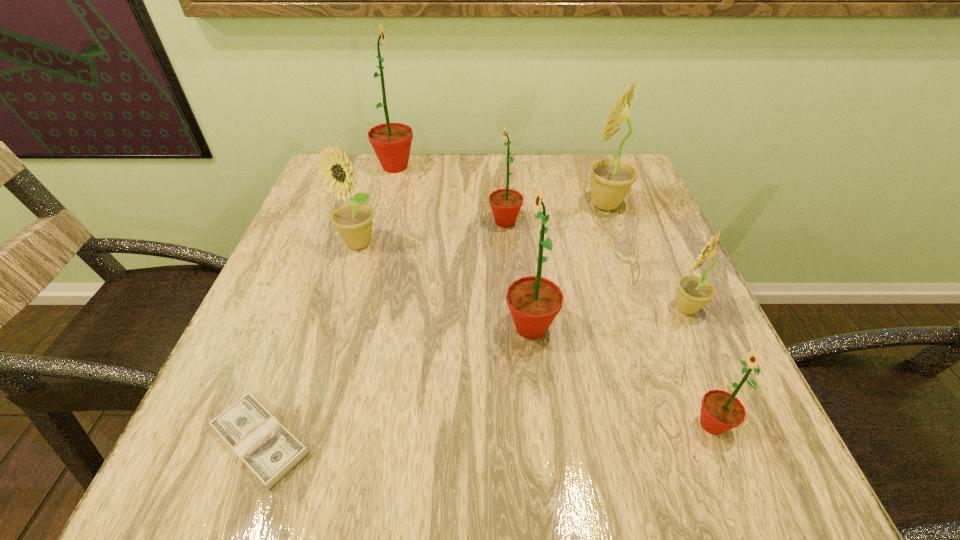
Find the location of a particular element. The image size is (960, 540). dollar at the near edge is located at coordinates pos(270,451).

The image size is (960, 540). What are the coordinates of `dollar that is at the left edge` in the screenshot? It's located at (270, 451).

Image resolution: width=960 pixels, height=540 pixels. Identify the location of object situated at the far left corner. (391, 142).

Locate an element on the screen. This screenshot has width=960, height=540. object that is at the near left corner is located at coordinates (270, 451).

You are a GUI agent. You are given a task and a screenshot of the screen. Output one action in this format:
    pyautogui.click(x=<x>, y=<y>)
    Task: Click on the object located in the far right corner section of the desktop
    Image resolution: width=960 pixels, height=540 pixels.
    Given the screenshot: What is the action you would take?
    pyautogui.click(x=611, y=180)

In order to click on object positioned at the near right corner in this screenshot , I will do `click(721, 411)`.

Locate an element on the screen. free space at the far edge of the desktop is located at coordinates (391, 176).

This screenshot has width=960, height=540. What are the coordinates of `free point at the near edge` in the screenshot? It's located at (372, 467).

The width and height of the screenshot is (960, 540). In the image, there is a desktop. Identify the location of vacant region at the left edge. (336, 205).

Locate an element on the screen. vacant area at the right edge is located at coordinates (647, 222).